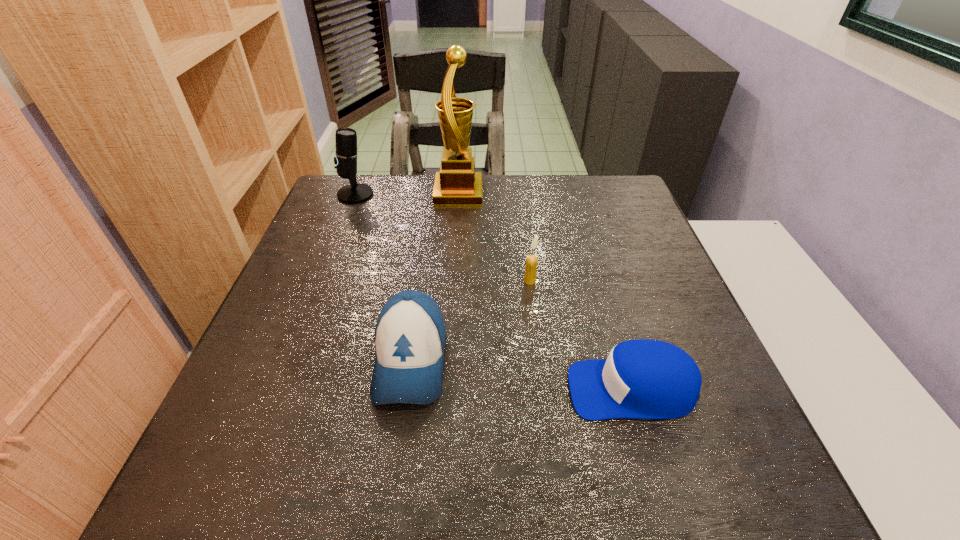
In the image, there is a desktop. Where is `free space at the far edge`? The height and width of the screenshot is (540, 960). free space at the far edge is located at coordinates (537, 219).

The image size is (960, 540). I want to click on vacant space at the near edge, so click(x=652, y=497).

I want to click on free space at the left edge, so click(x=355, y=225).

Find the location of a particular element. This screenshot has width=960, height=540. vacant space at the right edge is located at coordinates (634, 291).

This screenshot has width=960, height=540. What are the coordinates of `vacant area at the far left corner` in the screenshot? It's located at (352, 208).

At what (x,y) coordinates should I click in order to perform the action: click on vacant space at the far right corner. Please return your answer as a coordinate pair (x, y). The width and height of the screenshot is (960, 540). Looking at the image, I should click on (636, 205).

I want to click on unoccupied area between the left baseball cap and the candle, so click(470, 320).

Image resolution: width=960 pixels, height=540 pixels. Find the location of `vacant space that is in between the tallest object and the third nearest object`. vacant space that is in between the tallest object and the third nearest object is located at coordinates (494, 237).

This screenshot has height=540, width=960. Find the location of `free space between the award and the second object from right to left`. free space between the award and the second object from right to left is located at coordinates (494, 237).

At what (x,y) coordinates should I click in order to perform the action: click on unoccupied position between the second tallest object and the third nearest object. Please return your answer as a coordinate pair (x, y). Looking at the image, I should click on (443, 238).